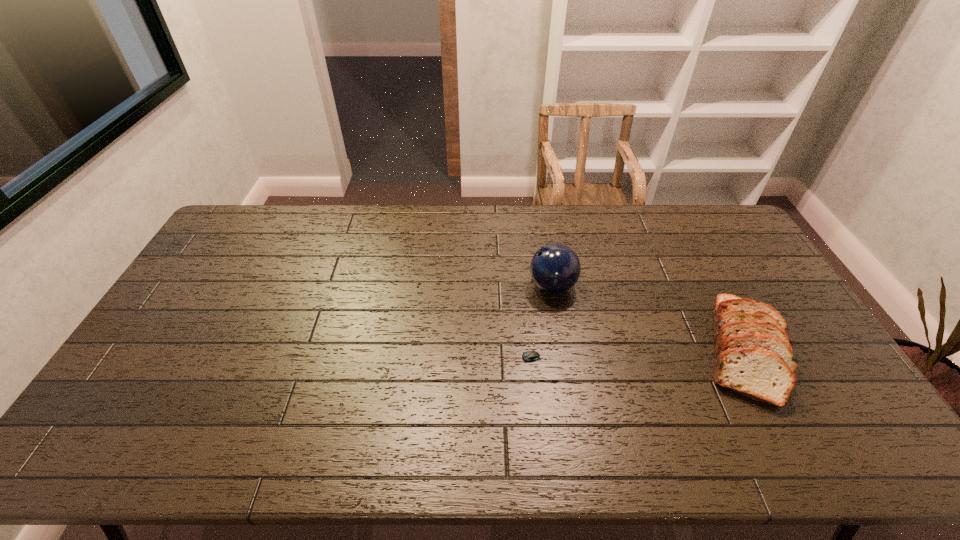
Find the location of a particular element. bowling ball is located at coordinates (555, 268).

The height and width of the screenshot is (540, 960). Identify the location of the second shortest object. (753, 355).

Where is `the rightmost object`? The height and width of the screenshot is (540, 960). the rightmost object is located at coordinates click(x=753, y=355).

Locate an element on the screen. The height and width of the screenshot is (540, 960). the shortest object is located at coordinates pos(530,356).

I want to click on free location located on the surface of the bowling ball near the finger holes, so click(x=458, y=286).

Identify the location of vacant space located on the surface of the bowling ball near the finger holes. (451, 286).

Where is `vacant area situated 0.280m on the surface of the bowling ball near the finger holes`? vacant area situated 0.280m on the surface of the bowling ball near the finger holes is located at coordinates (443, 286).

Image resolution: width=960 pixels, height=540 pixels. Find the location of `vacant space located 0.170m on the left of the rightmost object`. vacant space located 0.170m on the left of the rightmost object is located at coordinates (636, 350).

This screenshot has height=540, width=960. What are the coordinates of `vacant space situated on the back of the mouse` in the screenshot? It's located at (514, 291).

Image resolution: width=960 pixels, height=540 pixels. Find the location of `object at the right edge`. object at the right edge is located at coordinates (753, 355).